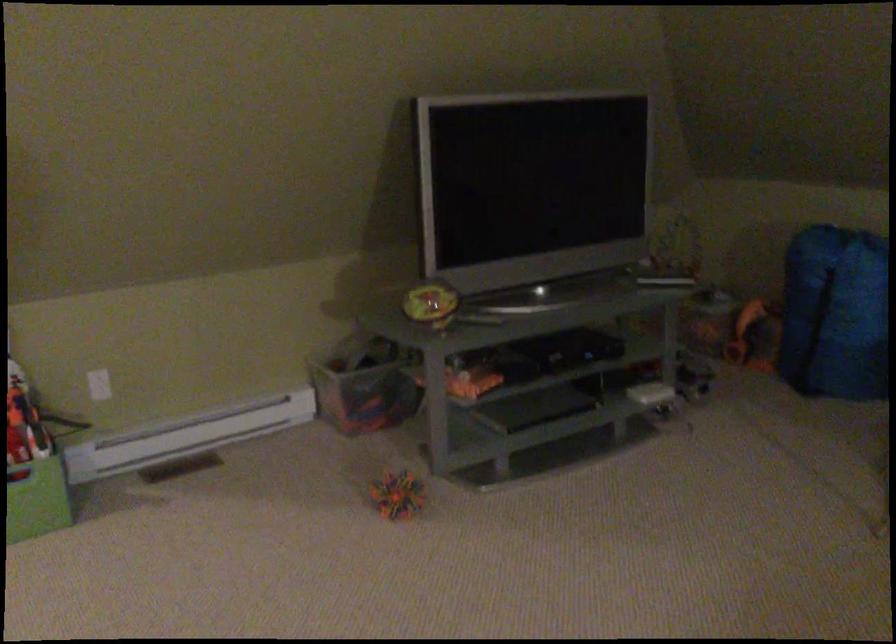
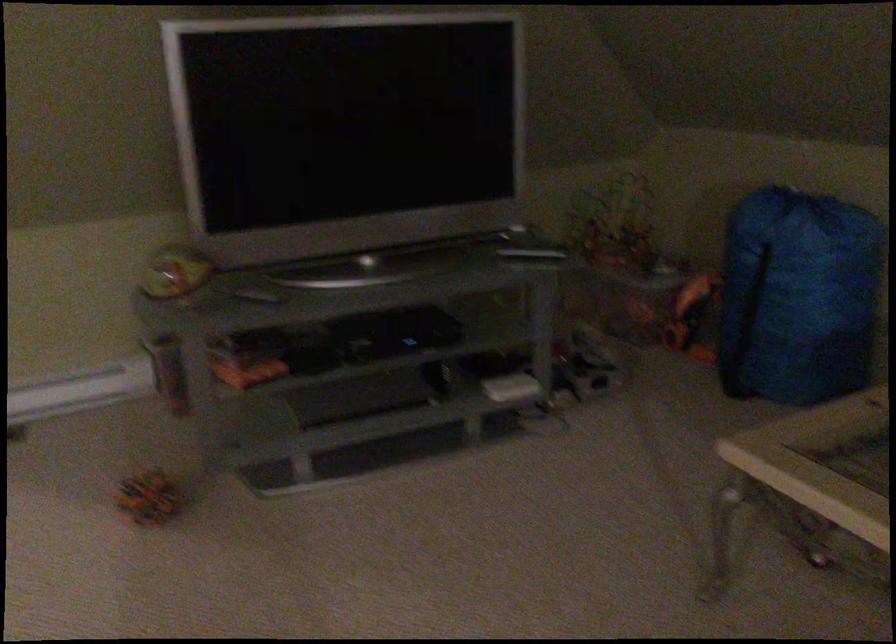
Question: How did the camera likely rotate?

Choices:
 (A) Left
 (B) Right
 (C) Up
 (D) Down

Answer: (A)